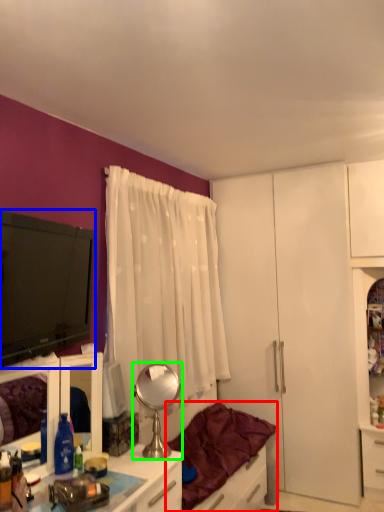
Question: Which is nearer to the studio couch (highlighted by a red box)? television (highlighted by a blue box) or mirror (highlighted by a green box).

Choices:
 (A) television
 (B) mirror

Answer: (B)